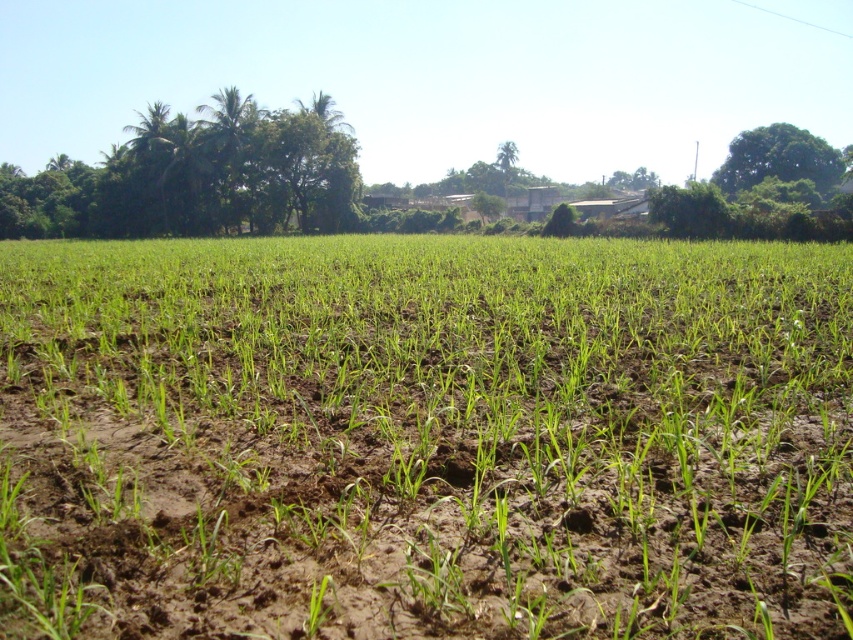
You are standing in the middle of the agricultural field and want to walk to the point that is closer to you. Which point should you head towards, point (x=805, y=138) or point (x=511, y=157)?

You should head towards point (x=805, y=138) because it is closer to the viewer than point (x=511, y=157).

You are a farmer standing in the middle of the green grassy field at center. You want to check the health of the green leafy tree at upper center. Which direction should you walk to reach it?

The green leafy tree at upper center is located above the green grassy field at center, so you should walk towards the upper direction to reach it.

You are a farmer planning to plant new crops in the field. You notice the green leafy trees at upper left and the green leafy tree at upper center. Which tree would cast a larger shadow on the crops during midday?

The green leafy trees at upper left is bigger than the green leafy tree at upper center, so it would cast a larger shadow on the crops during midday.